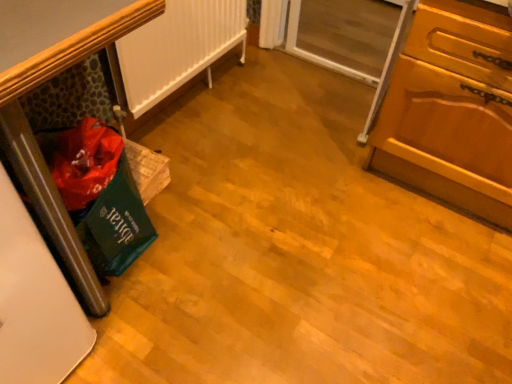
Question: From the image's perspective, is wooden cabinet at right over green fabric bag at left?

Choices:
 (A) no
 (B) yes

Answer: (B)

Question: From the image's perspective, would you say wooden cabinet at right is shown under green fabric bag at left?

Choices:
 (A) no
 (B) yes

Answer: (A)

Question: Is wooden cabinet at right closer to the viewer compared to green fabric bag at left?

Choices:
 (A) yes
 (B) no

Answer: (A)

Question: Is wooden cabinet at right not near green fabric bag at left?

Choices:
 (A) no
 (B) yes

Answer: (B)

Question: From a real-world perspective, is wooden cabinet at right located beneath green fabric bag at left?

Choices:
 (A) yes
 (B) no

Answer: (B)

Question: Is transparent glass screen door at upper right spatially inside white matte radiator at left, or outside of it?

Choices:
 (A) outside
 (B) inside

Answer: (A)

Question: From a real-world perspective, relative to white matte radiator at left, is transparent glass screen door at upper right vertically above or below?

Choices:
 (A) below
 (B) above

Answer: (A)

Question: Considering the relative positions of transparent glass screen door at upper right and white matte radiator at left in the image provided, is transparent glass screen door at upper right to the left or to the right of white matte radiator at left?

Choices:
 (A) left
 (B) right

Answer: (B)

Question: Does point (357, 57) appear closer or farther from the camera than point (147, 107)?

Choices:
 (A) farther
 (B) closer

Answer: (A)

Question: Is wooden cabinet at right inside or outside of transparent glass screen door at upper right?

Choices:
 (A) outside
 (B) inside

Answer: (A)

Question: Is point (441, 135) closer or farther from the camera than point (318, 49)?

Choices:
 (A) closer
 (B) farther

Answer: (A)

Question: Considering the positions of wooden cabinet at right and transparent glass screen door at upper right in the image, is wooden cabinet at right wider or thinner than transparent glass screen door at upper right?

Choices:
 (A) thin
 (B) wide

Answer: (B)

Question: Based on their positions, is wooden cabinet at right located to the left or right of transparent glass screen door at upper right?

Choices:
 (A) right
 (B) left

Answer: (A)

Question: Do you think green fabric bag at left is within white matte radiator at left, or outside of it?

Choices:
 (A) outside
 (B) inside

Answer: (A)

Question: From the image's perspective, is green fabric bag at left positioned above or below white matte radiator at left?

Choices:
 (A) below
 (B) above

Answer: (A)